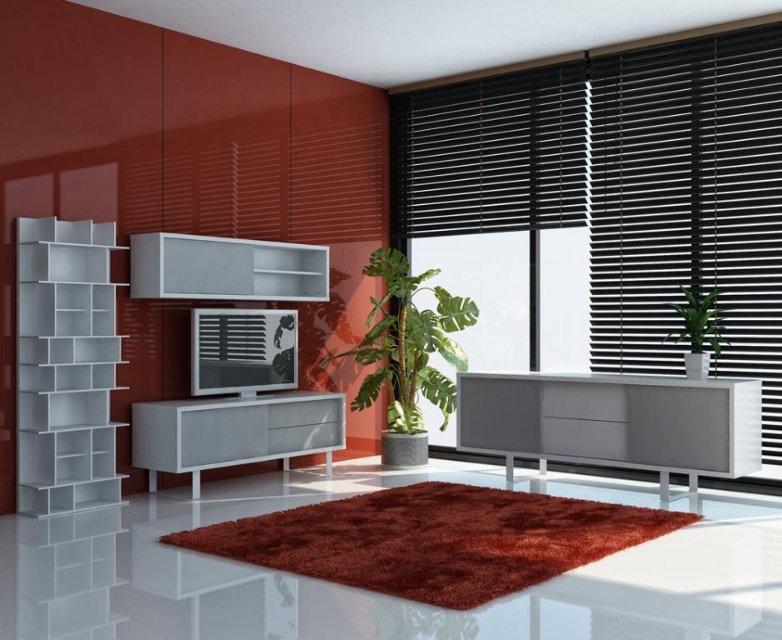
You are arranging plants in a modern living room with bold red walls. You have a small potted plant and a large potted plant. The white glossy cabinet at center is to the right of the white glossy shelf at center. Where should you place the small potted plant to ensure it is between the two white glossy furniture pieces?

Place the small potted plant between the white glossy cabinet at center and the white glossy shelf at center, since the cabinet is to the right of the shelf. This positioning will keep the plant centered and balanced between the two items.

Consider the image. You are planning to replace the black matte blinds at right with new ones that are 1.5 meters wide. The current white matte bookshelf at left is 1.2 meters wide. Will the new blinds be wider than the bookshelf?

The black matte blinds at right are wider than the white matte bookshelf at left according to the description, so the new 1.5 meter wide blinds will indeed be wider than the 1.2 meter wide bookshelf.

You are standing in the living room and see two points marked on the wall. The first point is at coordinates point (414, 276) and the second is at point (203, 273). Which point is closer to the ceiling?

Point (203, 273) is closer to the ceiling because it has a lower y coordinate value than point (414, 276). In coordinate systems, lower y values typically correspond to higher positions on the wall, so the second point is nearer to the ceiling.